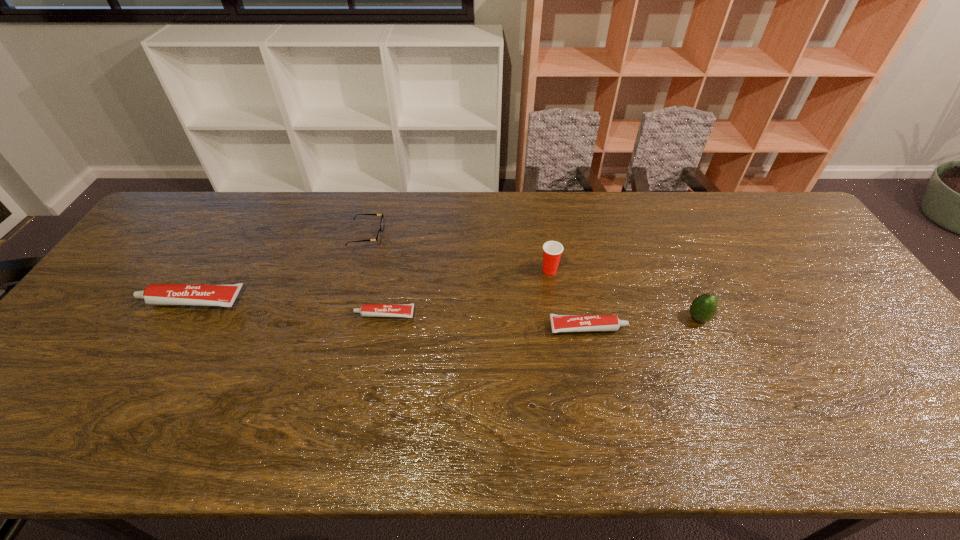
Find the location of `vacant space that satisfies the following two spatial constraints: 1. at the nozzle of the avocado; 2. on the right side of the shortest object`. vacant space that satisfies the following two spatial constraints: 1. at the nozzle of the avocado; 2. on the right side of the shortest object is located at coordinates (383, 318).

Find the location of `vacant space that satisfies the following two spatial constraints: 1. on the front-facing side of the farthest object; 2. on the back side of the fifth nearest object`. vacant space that satisfies the following two spatial constraints: 1. on the front-facing side of the farthest object; 2. on the back side of the fifth nearest object is located at coordinates (357, 270).

Locate an element on the screen. This screenshot has height=540, width=960. vacant space that satisfies the following two spatial constraints: 1. on the back side of the rightmost object; 2. at the nozzle of the shortest toothpaste is located at coordinates (696, 314).